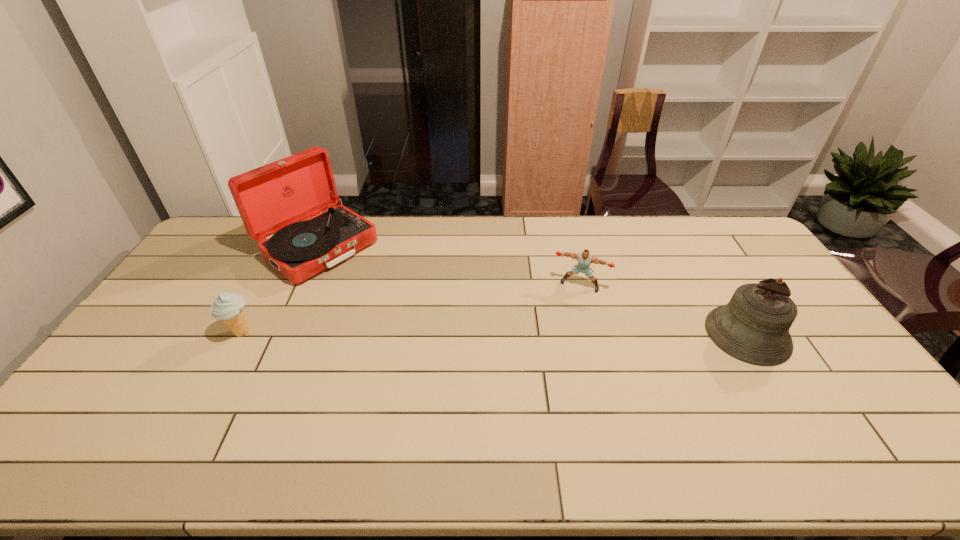
Locate an element on the screen. unoccupied position between the tallest object and the second object from right to left is located at coordinates (449, 266).

This screenshot has height=540, width=960. I want to click on vacant space that is in between the puncher and the icecream, so click(411, 308).

You are a GUI agent. You are given a task and a screenshot of the screen. Output one action in this format:
    pyautogui.click(x=<x>, y=<y>)
    Task: Click on the empty space between the icecream and the rightmost object
    Image resolution: width=960 pixels, height=540 pixels.
    Given the screenshot: What is the action you would take?
    pyautogui.click(x=494, y=333)

Identify the location of unoccupied area between the tallest object and the icecream. (280, 290).

At what (x,y) coordinates should I click in order to perform the action: click on free spot between the rightmost object and the icecream. Please return your answer as a coordinate pair (x, y). Looking at the image, I should click on (494, 333).

Where is `free spot between the puncher and the rightmost object`? The width and height of the screenshot is (960, 540). free spot between the puncher and the rightmost object is located at coordinates (663, 310).

Image resolution: width=960 pixels, height=540 pixels. I want to click on vacant space in between the tallest object and the puncher, so click(449, 266).

At what (x,y) coordinates should I click in order to perform the action: click on free area in between the icecream and the third shortest object. Please return your answer as a coordinate pair (x, y). Looking at the image, I should click on (494, 333).

At what (x,y) coordinates should I click in order to perform the action: click on free area in between the puncher and the icecream. Please return your answer as a coordinate pair (x, y). Looking at the image, I should click on (411, 308).

Choose which object is the nearest neighbor to the tallest object. Please provide its 2D coordinates. Your answer should be formatted as a tuple, i.e. [(x, y)], where the tuple contains the x and y coordinates of a point satisfying the conditions above.

[(229, 307)]